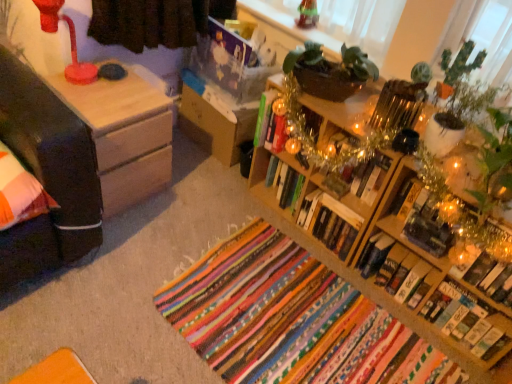
This screenshot has width=512, height=384. I want to click on vacant space that is in between wooden nightstand at left and hardcover book at center-right, positioned as the 5th book in right-to-left order, so click(x=230, y=230).